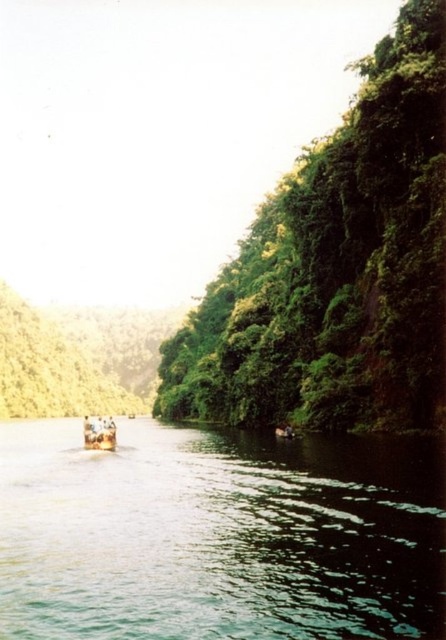
Question: Is green leafy trees at right to the right of wooden boat at lower left from the viewer's perspective?

Choices:
 (A) no
 (B) yes

Answer: (B)

Question: Estimate the real-world distances between objects in this image. Which object is farther from the green leafy tree at center?

Choices:
 (A) wooden boat at lower left
 (B) green glossy water at center
 (C) green leafy trees at right

Answer: (A)

Question: Which is nearer to the wooden boat at lower left?

Choices:
 (A) green glossy water at center
 (B) green leafy tree at center
 (C) green leafy trees at right

Answer: (A)

Question: Does green glossy water at center have a greater width compared to green leafy trees at right?

Choices:
 (A) yes
 (B) no

Answer: (A)

Question: Which object is closer to the camera taking this photo?

Choices:
 (A) wooden boat at lower left
 (B) green leafy trees at right
 (C) green leafy tree at center

Answer: (B)

Question: Does green glossy water at center appear over wooden boat at lower left?

Choices:
 (A) yes
 (B) no

Answer: (B)